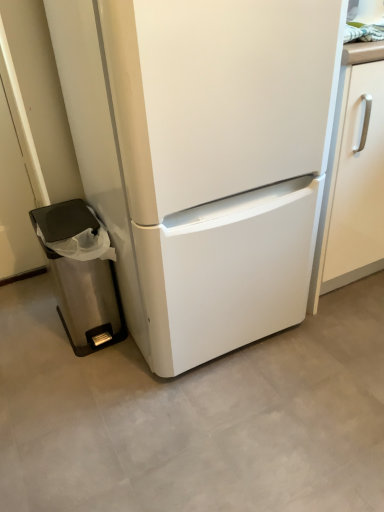
Question: Is stainless steel trash can at left shorter than white matte refrigerator at center?

Choices:
 (A) yes
 (B) no

Answer: (A)

Question: Considering the relative sizes of stainless steel trash can at left and white matte refrigerator at center in the image provided, is stainless steel trash can at left smaller than white matte refrigerator at center?

Choices:
 (A) no
 (B) yes

Answer: (B)

Question: Is stainless steel trash can at left outside of white matte refrigerator at center?

Choices:
 (A) no
 (B) yes

Answer: (B)

Question: Could you tell me if stainless steel trash can at left is turned towards white matte refrigerator at center?

Choices:
 (A) yes
 (B) no

Answer: (B)

Question: Is the depth of stainless steel trash can at left greater than that of white matte refrigerator at center?

Choices:
 (A) no
 (B) yes

Answer: (B)

Question: Does stainless steel trash can at left have a larger size compared to white matte refrigerator at center?

Choices:
 (A) no
 (B) yes

Answer: (A)

Question: Is the position of white matte refrigerator at center more distant than that of stainless steel trash can at left?

Choices:
 (A) no
 (B) yes

Answer: (A)

Question: Is white matte refrigerator at center positioned in front of stainless steel trash can at left?

Choices:
 (A) yes
 (B) no

Answer: (A)

Question: Is white matte refrigerator at center located outside stainless steel trash can at left?

Choices:
 (A) yes
 (B) no

Answer: (A)

Question: Is white matte refrigerator at center turned away from stainless steel trash can at left?

Choices:
 (A) yes
 (B) no

Answer: (B)

Question: From the image's perspective, is white matte refrigerator at center beneath stainless steel trash can at left?

Choices:
 (A) no
 (B) yes

Answer: (A)

Question: Does white matte refrigerator at center have a greater height compared to stainless steel trash can at left?

Choices:
 (A) no
 (B) yes

Answer: (B)

Question: From a real-world perspective, is stainless steel trash can at left positioned above or below white matte refrigerator at center?

Choices:
 (A) above
 (B) below

Answer: (B)